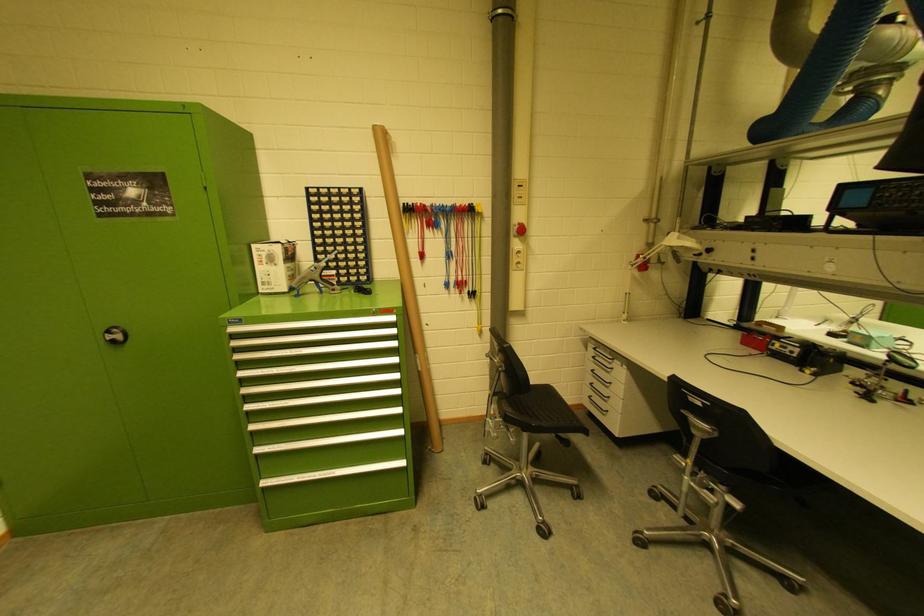
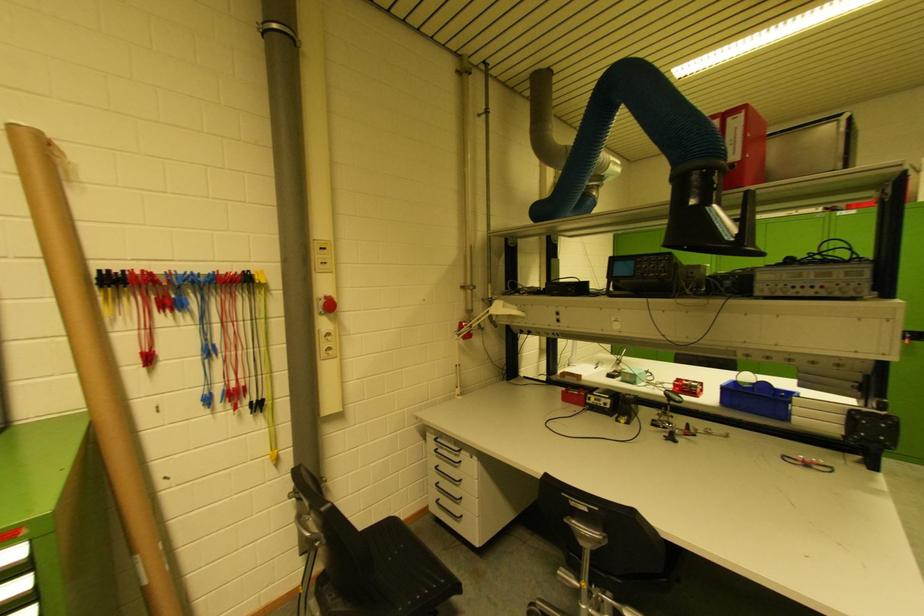
Question: The camera is either moving clockwise (left) or counter-clockwise (right) around the object. The first image is from the beginning of the video and the second image is from the end. Is the camera moving left or right when shooting the video?

Choices:
 (A) Left
 (B) Right

Answer: (A)